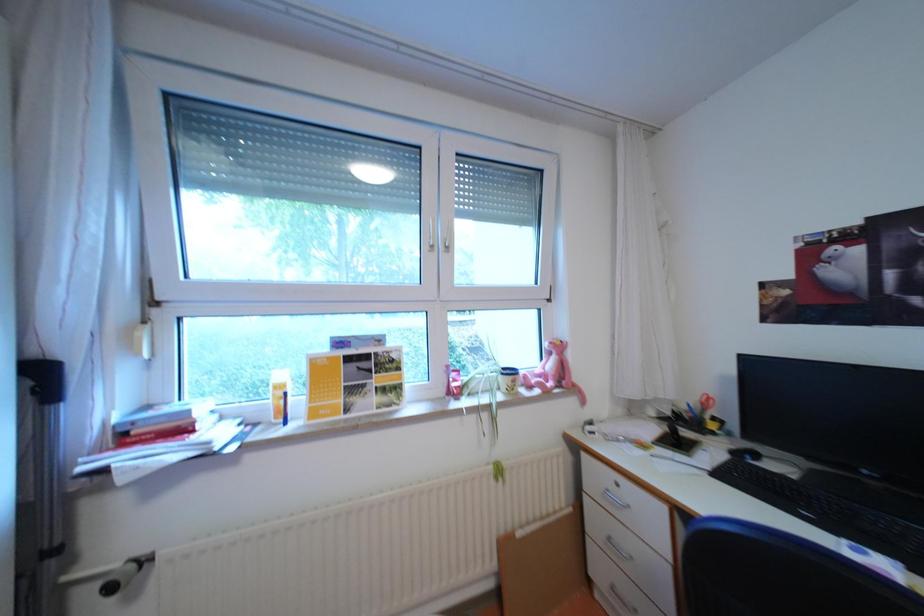
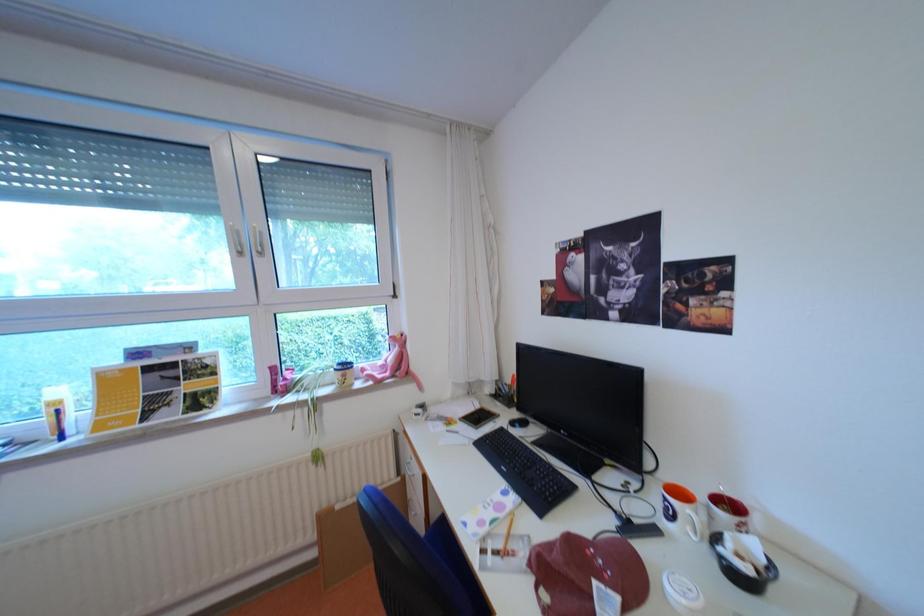
Question: What movement of the cameraman would produce the second image?

Choices:
 (A) Left
 (B) Right
 (C) Forward
 (D) Backward

Answer: (B)